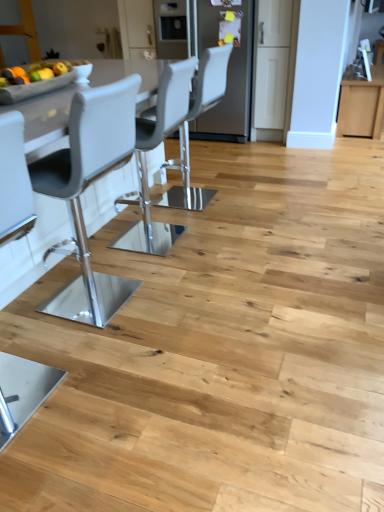
Find the location of a particular element. This screenshot has width=384, height=512. vacant space behind matte gray chair at left, placed as the second chair when sorted from back to front is located at coordinates pos(54,339).